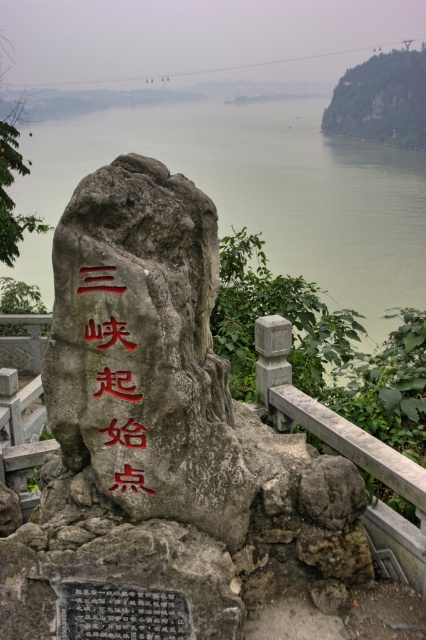
Question: Which object appears closest to the camera in this image?

Choices:
 (A) green water at center
 (B) red carved stone at center

Answer: (B)

Question: Which of the following is the farthest from the observer?

Choices:
 (A) (152, 592)
 (B) (108, 384)
 (C) (203, 257)

Answer: (C)

Question: Which of these objects is positioned closest to the red carved stone at center?

Choices:
 (A) green water at center
 (B) rough gray rock at center

Answer: (B)

Question: Where is green water at center located in relation to black stone plaque at center in the image?

Choices:
 (A) right
 (B) left

Answer: (A)

Question: Does rough gray rock at center appear on the left side of red carved stone at center?

Choices:
 (A) yes
 (B) no

Answer: (B)

Question: Can you confirm if black stone plaque at center is positioned below red carved stone at center?

Choices:
 (A) no
 (B) yes

Answer: (B)